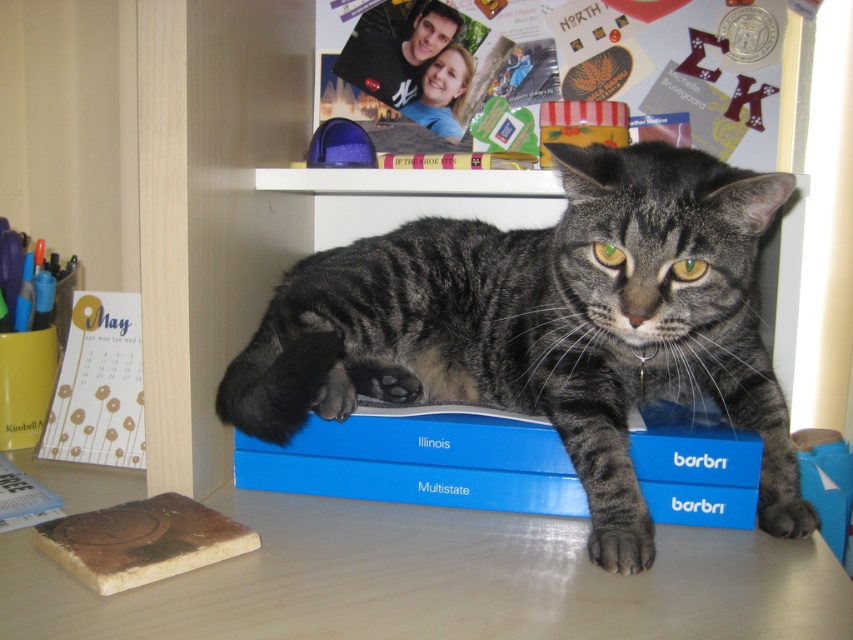
Question: Is gray tabby cat at center closer to the viewer compared to blue matte box at center?

Choices:
 (A) yes
 (B) no

Answer: (A)

Question: Which of the following is the farthest from the observer?

Choices:
 (A) gray tabby cat at center
 (B) blue matte box at center

Answer: (B)

Question: Estimate the real-world distances between objects in this image. Which object is farther from the wooden table at lower center?

Choices:
 (A) gold paper calendar at left
 (B) gray tabby cat at center
 (C) blue matte box at center

Answer: (A)

Question: Estimate the real-world distances between objects in this image. Which object is farther from the gold paper calendar at left?

Choices:
 (A) gray tabby cat at center
 (B) blue matte box at center

Answer: (A)

Question: Can you confirm if wooden table at lower center is bigger than blue matte box at center?

Choices:
 (A) yes
 (B) no

Answer: (A)

Question: Does wooden table at lower center appear over gold paper calendar at left?

Choices:
 (A) no
 (B) yes

Answer: (A)